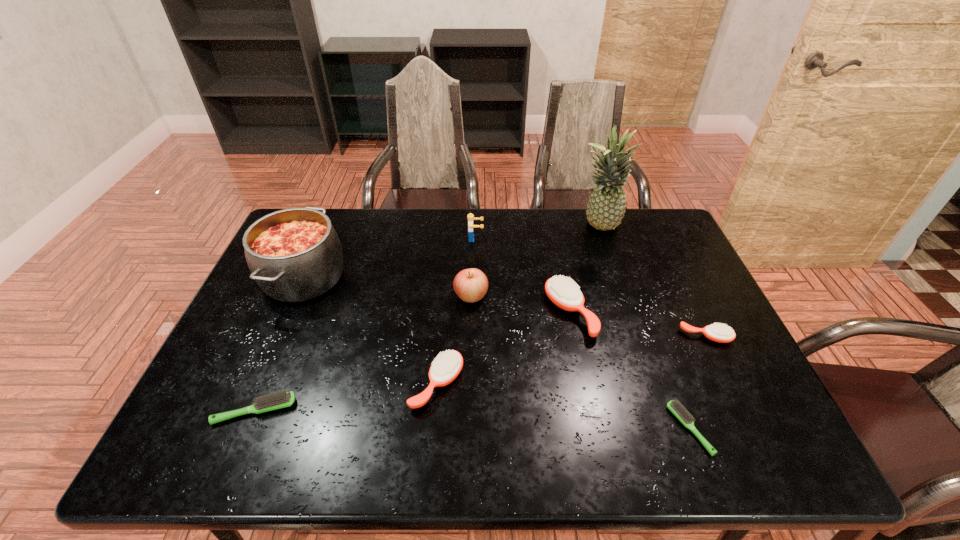
Where is `the rightmost object`? the rightmost object is located at coordinates (717, 332).

In order to click on the rightmost orange hairbrush in this screenshot , I will do `click(717, 332)`.

You are a GUI agent. You are given a task and a screenshot of the screen. Output one action in this format:
    pyautogui.click(x=<x>, y=<y>)
    Task: Click on the left light hairbrush
    Image resolution: width=960 pixels, height=540 pixels.
    Given the screenshot: What is the action you would take?
    pyautogui.click(x=281, y=399)

The width and height of the screenshot is (960, 540). Identify the location of the leftmost hairbrush. (281, 399).

Locate an element on the screen. The height and width of the screenshot is (540, 960). the shortest hairbrush is located at coordinates (683, 415).

Identify the location of the smaller light hairbrush. The height and width of the screenshot is (540, 960). (683, 415).

Locate an element on the screen. Image resolution: width=960 pixels, height=540 pixels. free region located 0.380m on the left of the pineapple is located at coordinates (464, 227).

Where is `free space located on the back of the casserole`? This screenshot has width=960, height=540. free space located on the back of the casserole is located at coordinates (333, 210).

Find the location of a particular element. free region located 0.340m on the face of the blue Lego is located at coordinates (586, 239).

Where is `vacant space positioned on the back of the apple`? The image size is (960, 540). vacant space positioned on the back of the apple is located at coordinates (472, 212).